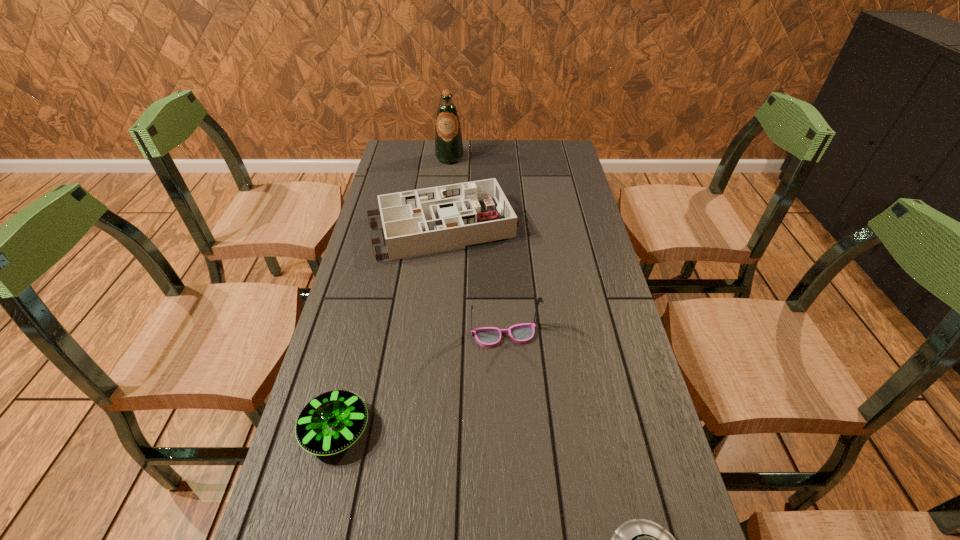
The image size is (960, 540). In order to click on the tallest object in this screenshot , I will do click(448, 140).

Image resolution: width=960 pixels, height=540 pixels. I want to click on olive oil, so pos(448,140).

At what (x,y) coordinates should I click in order to perform the action: click on the third farthest object. Please return your answer as a coordinate pair (x, y). The image size is (960, 540). Looking at the image, I should click on (488, 337).

Locate an element on the screen. the second tallest object is located at coordinates (488, 337).

Find the location of a particular element. The height and width of the screenshot is (540, 960). the second farthest object is located at coordinates (417, 222).

Identify the location of the second shortest object. (331, 422).

Find the location of `the left saucer`. the left saucer is located at coordinates (331, 422).

At what (x,y) coordinates should I click in order to perform the action: click on free point located on the front-facing side of the tallest object. Please return your answer as a coordinate pair (x, y). Looking at the image, I should click on (447, 180).

This screenshot has width=960, height=540. I want to click on vacant region located on the right of the third nearest object, so click(x=605, y=335).

I want to click on vacant area situated on the right of the dollhouse, so click(x=583, y=228).